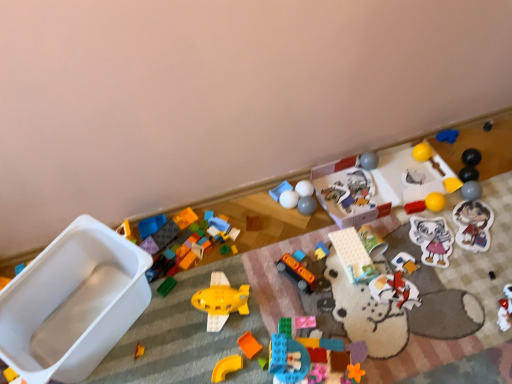
Find the location of a particular element. The height and width of the screenshot is (384, 512). unoccupied space behind matte plastic stickers at lower right, which is counted as the third toy, starting from the right is located at coordinates (459, 195).